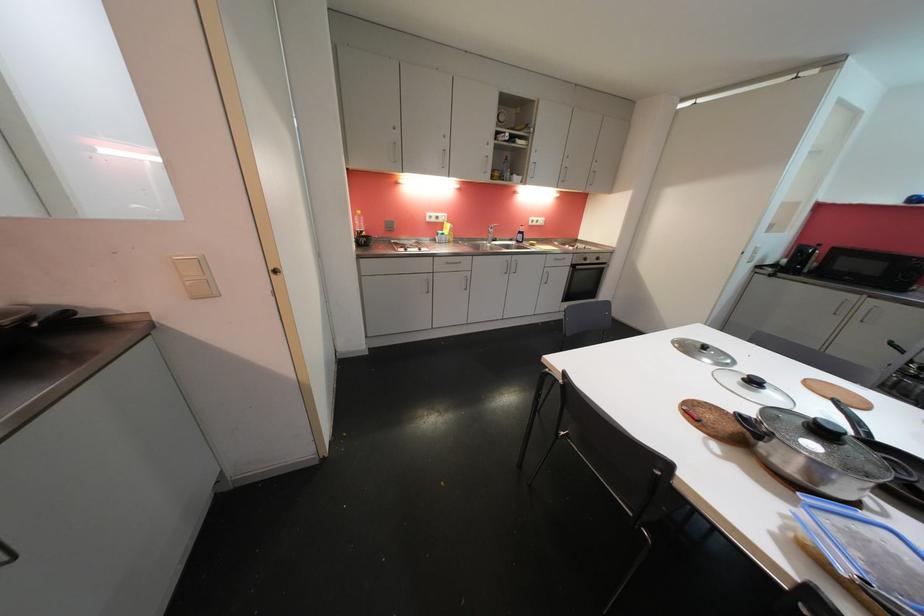
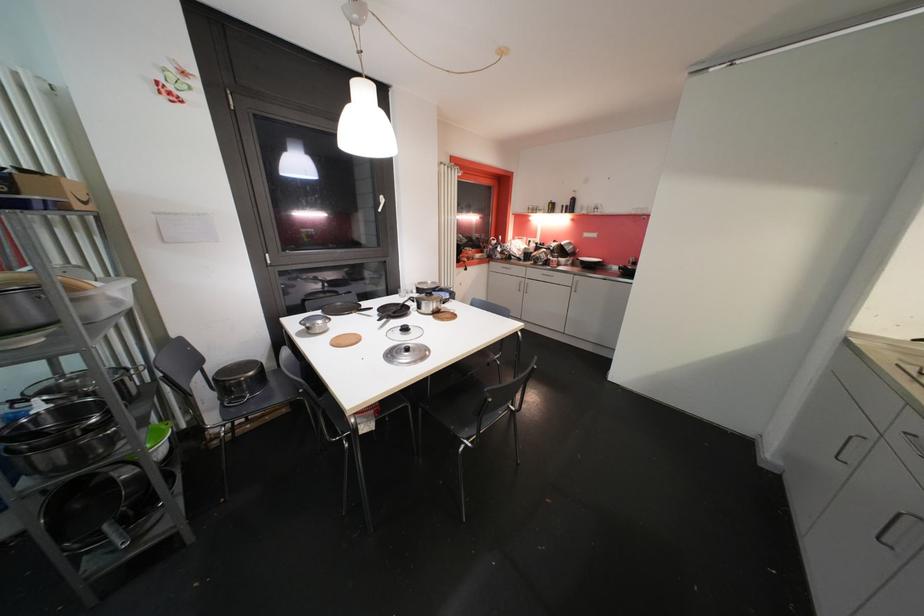
The point at [748,419] is marked in the first image. Where is the corresponding point in the second image?

(450, 305)